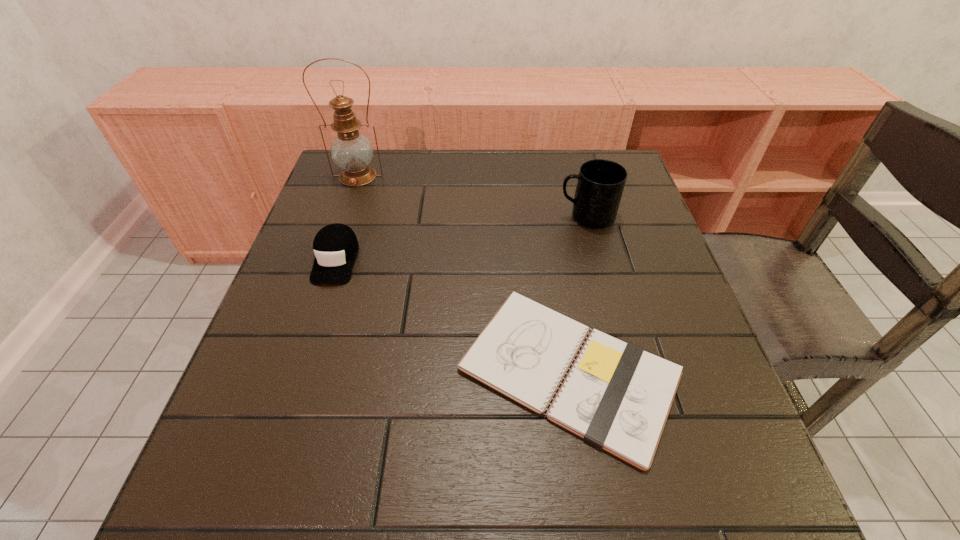
The height and width of the screenshot is (540, 960). What are the coordinates of `object that is at the far left corner` in the screenshot? It's located at (351, 151).

Image resolution: width=960 pixels, height=540 pixels. I want to click on object located at the near right corner, so click(616, 396).

Locate an element on the screen. This screenshot has height=540, width=960. free space at the far edge of the desktop is located at coordinates (513, 152).

What are the coordinates of `vacant space at the near edge of the desktop` in the screenshot? It's located at (454, 492).

The width and height of the screenshot is (960, 540). I want to click on free space at the left edge of the desktop, so click(351, 225).

The image size is (960, 540). In order to click on vacant space at the right edge of the desktop in this screenshot , I will do `click(650, 228)`.

In the image, there is a desktop. Identify the location of vacant space at the near left corner. Image resolution: width=960 pixels, height=540 pixels. (195, 528).

At what (x,y) coordinates should I click in order to perform the action: click on free point between the nearest object and the tallest object. Please return your answer as a coordinate pair (x, y). Looking at the image, I should click on (464, 274).

This screenshot has height=540, width=960. Find the location of `vacant space that's between the mug and the oil lamp`. vacant space that's between the mug and the oil lamp is located at coordinates (472, 197).

You are a GUI agent. You are given a task and a screenshot of the screen. Output one action in this format:
    pyautogui.click(x=<x>, y=<y>)
    Task: Click on the free space that is in between the farthest object and the third nearest object
    The image size is (960, 540).
    Given the screenshot: What is the action you would take?
    pyautogui.click(x=472, y=197)